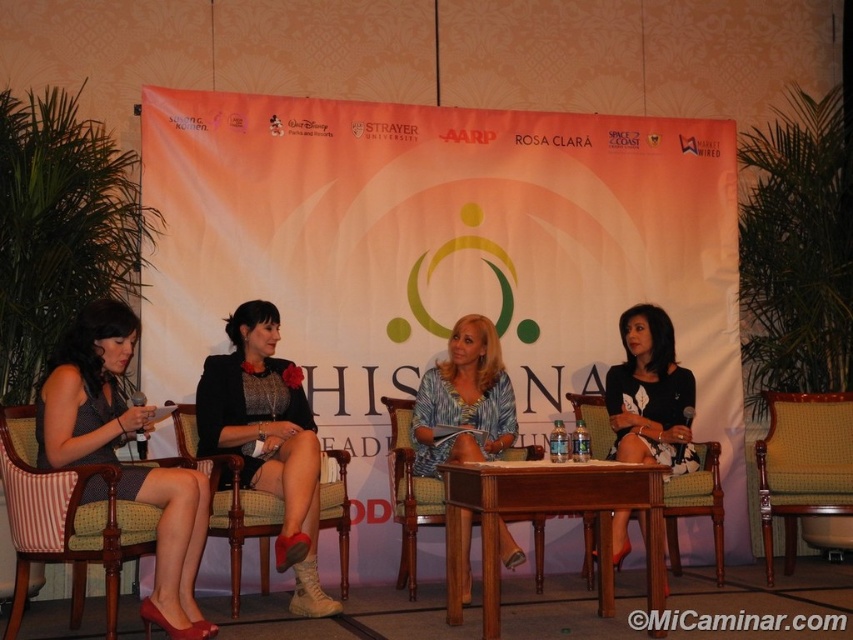
Which is more to the right, wooden armchair at center or green striped fabric chair at center?

Positioned to the right is green striped fabric chair at center.

At what (x,y) coordinates should I click in order to perform the action: click on wooden armchair at center. Please return your answer as a coordinate pair (x, y). The height and width of the screenshot is (640, 853). Looking at the image, I should click on (408, 492).

Image resolution: width=853 pixels, height=640 pixels. Find the location of `wooden armchair at center`. wooden armchair at center is located at coordinates (408, 492).

How far apart are matte black dress at left and yellow fabric chair at center?

They are 11.02 feet apart.

Between point (109, 412) and point (851, 508), which one is positioned behind?

Point (851, 508)

Does point (201, 636) come farther from viewer compared to point (764, 554)?

No, (201, 636) is closer to viewer.

The height and width of the screenshot is (640, 853). What are the coordinates of `matte black dress at left` in the screenshot? It's located at (90, 388).

Which of these two, wooden at center or wooden armchair at center, stands shorter?

wooden at center is shorter.

Can you confirm if wooden at center is shorter than wooden armchair at center?

Yes.

Does point (582, 468) come farther from viewer compared to point (403, 461)?

No.

This screenshot has width=853, height=640. I want to click on wooden at center, so click(x=547, y=513).